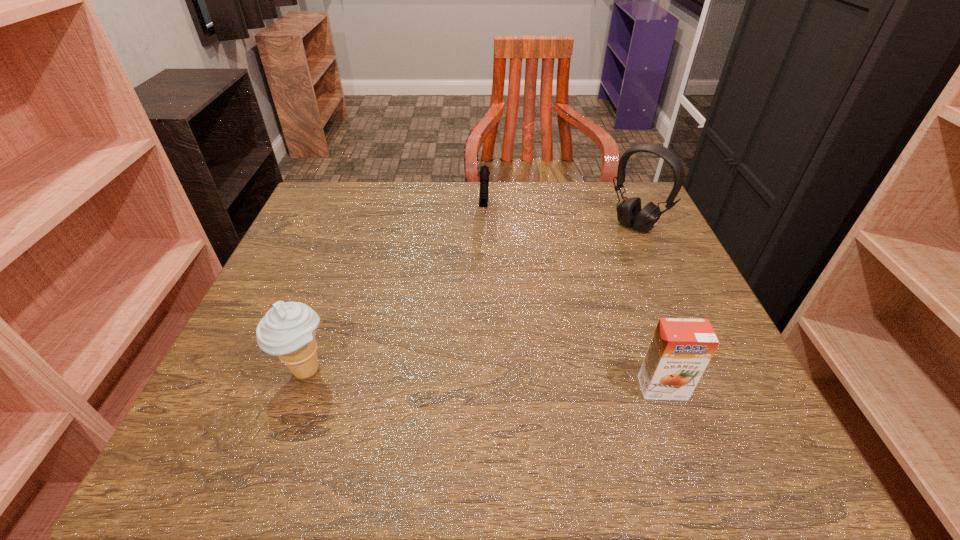
Identify the location of vacant space located on the front-facing side of the headset. The width and height of the screenshot is (960, 540). (589, 266).

You are a GUI agent. You are given a task and a screenshot of the screen. Output one action in this format:
    pyautogui.click(x=<x>, y=<y>)
    Task: Click on the vacant position located 0.060m on the front-facing side of the headset
    This screenshot has width=960, height=540.
    Given the screenshot: What is the action you would take?
    pyautogui.click(x=610, y=247)

I want to click on vacant area situated 0.050m on the front-facing side of the headset, so click(612, 245).

Where is `pistol at the far edge`? The width and height of the screenshot is (960, 540). pistol at the far edge is located at coordinates (484, 172).

This screenshot has width=960, height=540. Identify the location of headset located in the far edge section of the desktop. (629, 213).

The image size is (960, 540). Identify the location of icecream situated at the near edge. click(x=287, y=330).

Image resolution: width=960 pixels, height=540 pixels. I want to click on orange juice positioned at the near edge, so click(x=681, y=348).

This screenshot has height=540, width=960. Identify the location of object at the left edge. (287, 330).

Locate an element on the screen. orange juice that is at the right edge is located at coordinates (681, 348).

Locate an element on the screen. This screenshot has height=540, width=960. headset that is at the right edge is located at coordinates (629, 213).